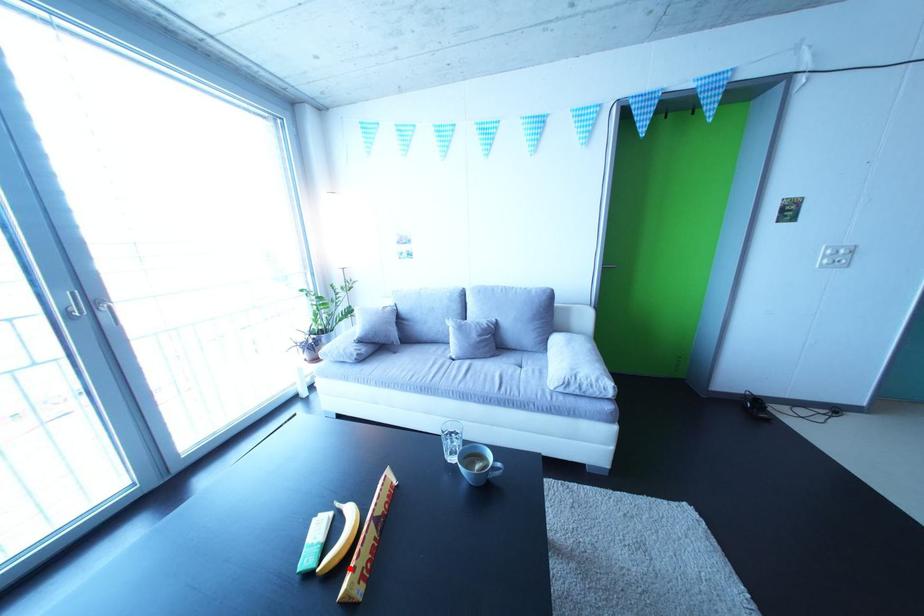
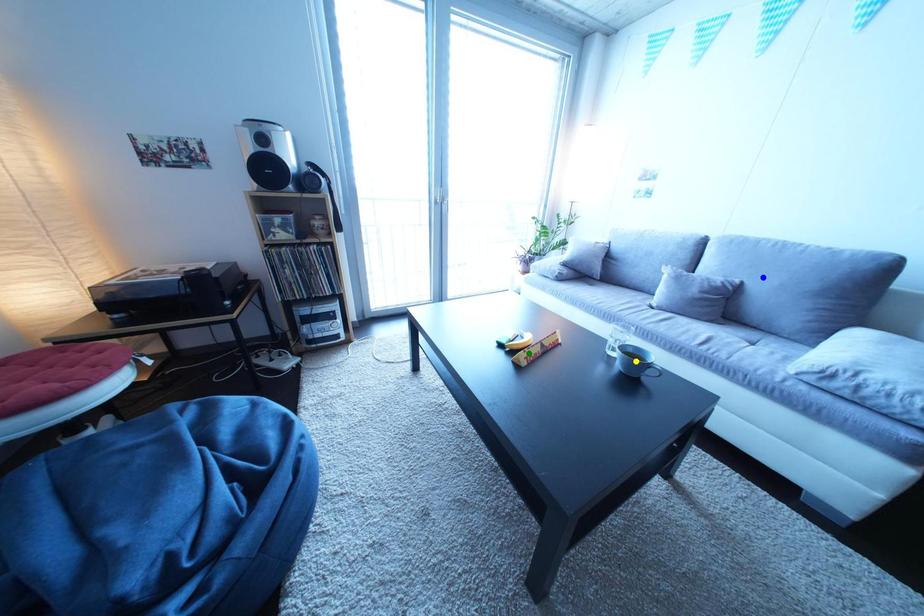
Question: I am providing you with two images of the same scene from different viewpoints. A red point is marked on the first image. You are given multiple points on the second image. In image 2, which mark is for the same physical point as the one in image 1?

Choices:
 (A) yellow point
 (B) green point
 (C) blue point

Answer: (B)